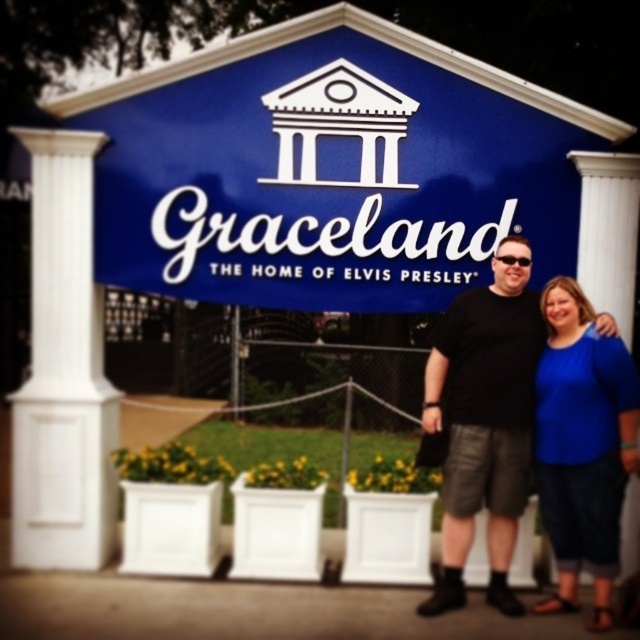
You are standing at the entrance of Graceland and want to take a photo of both the blue painted sign at center and the blue fabric shirt at center without moving either object. Since both are at the center, how far apart are they from each other?

The blue painted sign at center is 1.57 meters away from the blue fabric shirt at center, so they are 1.57 meters apart from each other.

You are an architect designing a new sign for Graceland. The current blue painted sign at center is wider than the white smooth column at left. If you want to maintain symmetry between the two, should you adjust the column or the sign?

Since the blue painted sign at center is wider than the white smooth column at left, to maintain symmetry, you should adjust the column by making it wider to match the sign.

You are a photographer trying to capture the entrance of Graceland. You want to ensure both the blue painted sign at center and the blue fabric shirt at center are clearly visible in your photo. Given their sizes, which object should you focus on first to ensure it is in sharp focus?

The blue painted sign at center has a larger size compared to the blue fabric shirt at center, so you should focus on the blue painted sign at center first to ensure it is in sharp focus.